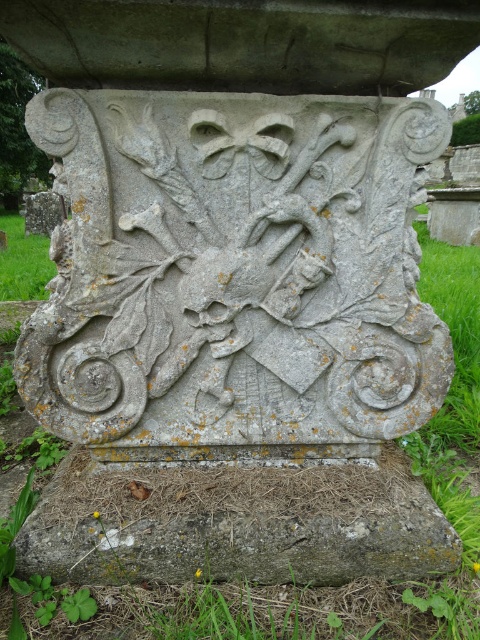
You are an archaeologist examining the stone structure. You notice two points marked on the carving. The first point is at coordinates point (39, 131) and the second is at point (36, 236). From your perspective, which point is closer to you?

Point (39, 131) is in front of point (36, 236), so the first point is closer to you.

You are an architect examining the stone structure. You notice the gray stone shield at center and the green grass at lower left. Which object is smaller in size?

The gray stone shield at center is smaller in size compared to the green grass at lower left.

You are an architect examining the stone structure. You notice the gray stone shield at center and the green grass at center. Which object is located to the right of the other?

The gray stone shield at center is positioned on the left side of green grass at center, so the green grass at center is to the right of the gray stone shield at center.